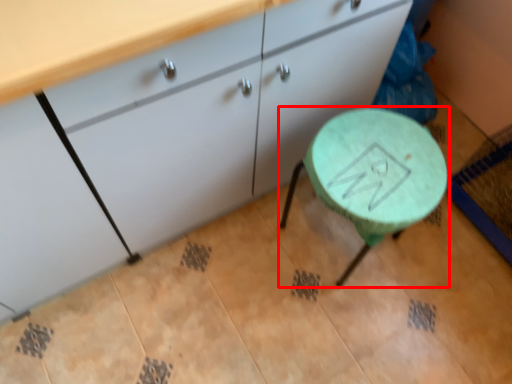
Question: From the image's perspective, considering the relative positions of table (annotated by the red box) and cabinetry in the image provided, where is table (annotated by the red box) located with respect to the staircase?

Choices:
 (A) above
 (B) below

Answer: (B)